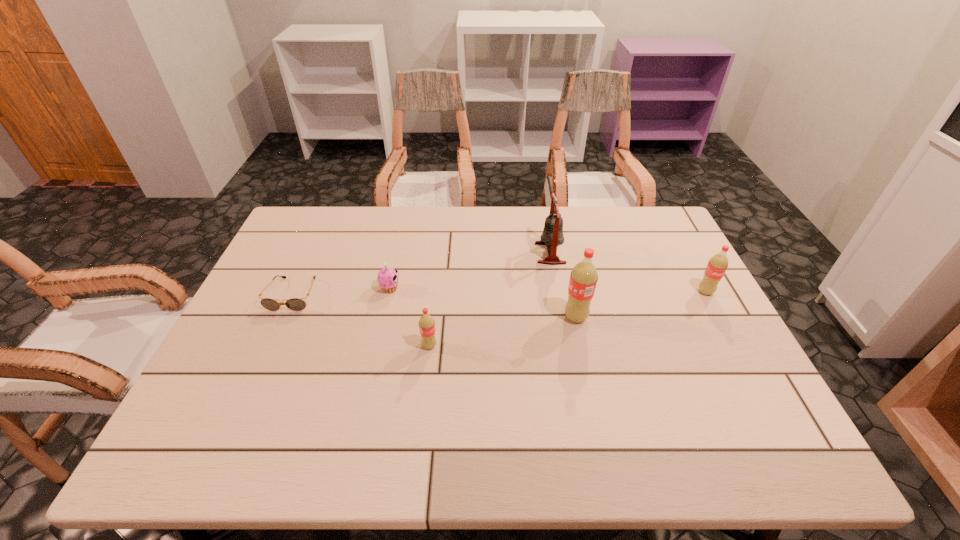
This screenshot has width=960, height=540. I want to click on vacant space that's between the second object from left to right and the rightmost object, so (548, 290).

The image size is (960, 540). Identify the location of free area in between the tallest soda and the rightmost object. (640, 305).

Locate an element on the screen. This screenshot has width=960, height=540. free spot between the fifth object from right to left and the rightmost object is located at coordinates (548, 290).

Locate an element on the screen. free spot between the farthest soda and the sunglasses is located at coordinates (499, 293).

Where is `free space between the rightmost soda and the tallest soda`? The width and height of the screenshot is (960, 540). free space between the rightmost soda and the tallest soda is located at coordinates (640, 305).

At what (x,y) coordinates should I click in order to perform the action: click on vacant point located between the nearest object and the shortest object. Please return your answer as a coordinate pair (x, y). Looking at the image, I should click on (361, 320).

Where is `vacant area between the farthest soda and the fifth tallest object`? The image size is (960, 540). vacant area between the farthest soda and the fifth tallest object is located at coordinates (548, 290).

Locate an element on the screen. object that is the third closest to the fourth tallest object is located at coordinates (583, 278).

Locate an element on the screen. object that stands as the fourth closest to the fourth tallest object is located at coordinates (552, 236).

Identify which soda is the second closest to the third object from left to right. Please provide its 2D coordinates. Your answer should be formatted as a tuple, i.e. [(x, y)], where the tuple contains the x and y coordinates of a point satisfying the conditions above.

[(717, 265)]